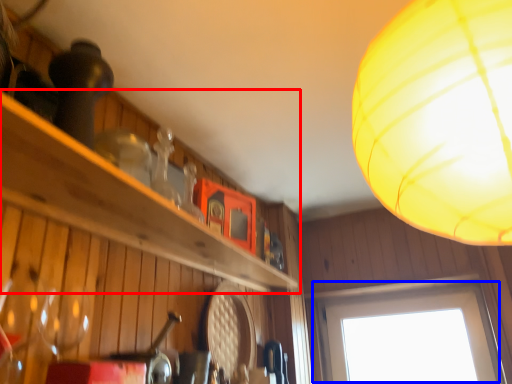
Question: Which point is further to the camera, shelf (highlighted by a red box) or window (highlighted by a blue box)?

Choices:
 (A) shelf
 (B) window

Answer: (B)